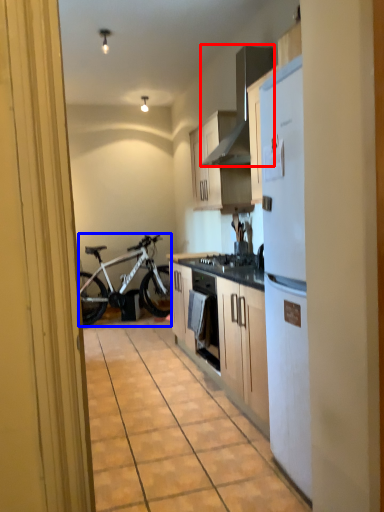
Question: Among these objects, which one is nearest to the camera, appliance (highlighted by a red box) or bicycle (highlighted by a blue box)?

Choices:
 (A) appliance
 (B) bicycle

Answer: (A)